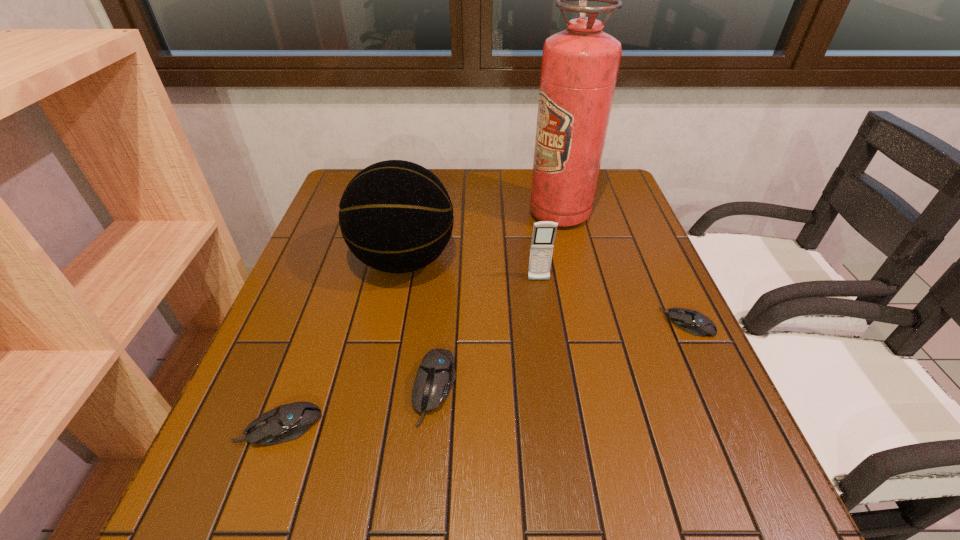
Find the location of a particular element. Image resolution: width=960 pixels, height=540 pixels. the second shortest object is located at coordinates (286, 422).

Find the location of a particular element. the leftmost computer mouse is located at coordinates (286, 422).

I want to click on the second computer mouse from left to right, so click(x=435, y=376).

You are a GUI agent. You are given a task and a screenshot of the screen. Output one action in this format:
    pyautogui.click(x=<x>, y=<y>)
    Task: Click on the shortest computer mouse
    
    Given the screenshot: What is the action you would take?
    pyautogui.click(x=691, y=321)

This screenshot has width=960, height=540. Find the location of `the third nearest object`. the third nearest object is located at coordinates (691, 321).

At what (x,y) coordinates should I click in order to perform the action: click on the second tallest object. Please return your answer as a coordinate pair (x, y). Image resolution: width=960 pixels, height=540 pixels. Looking at the image, I should click on (396, 216).

The width and height of the screenshot is (960, 540). I want to click on fire extinguisher, so click(580, 65).

I want to click on cellular telephone, so click(543, 236).

I want to click on vacant space situated 0.350m on the back of the second shortest object, so click(x=333, y=280).

Identify the location of free region located on the right of the second computer mouse from right to left. This screenshot has width=960, height=540. (492, 388).